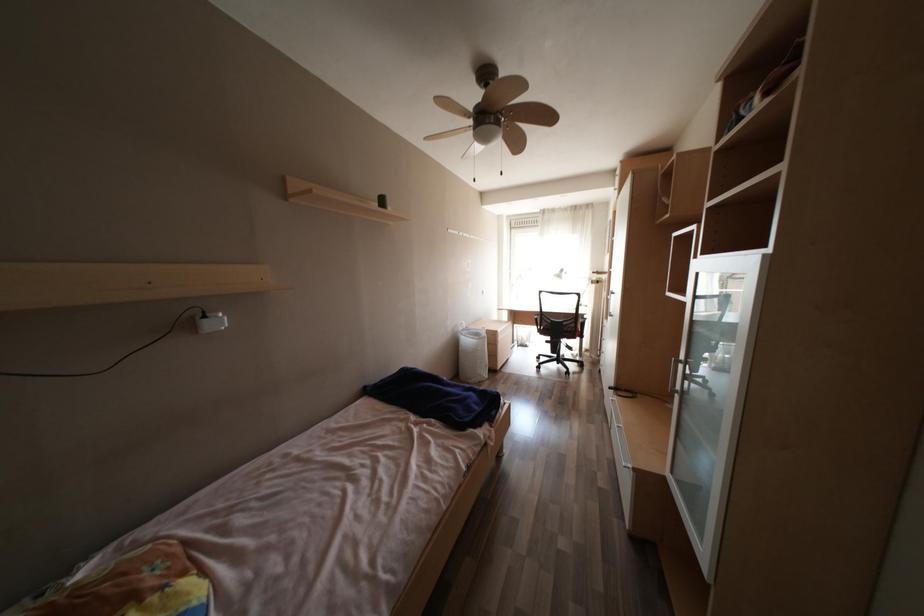
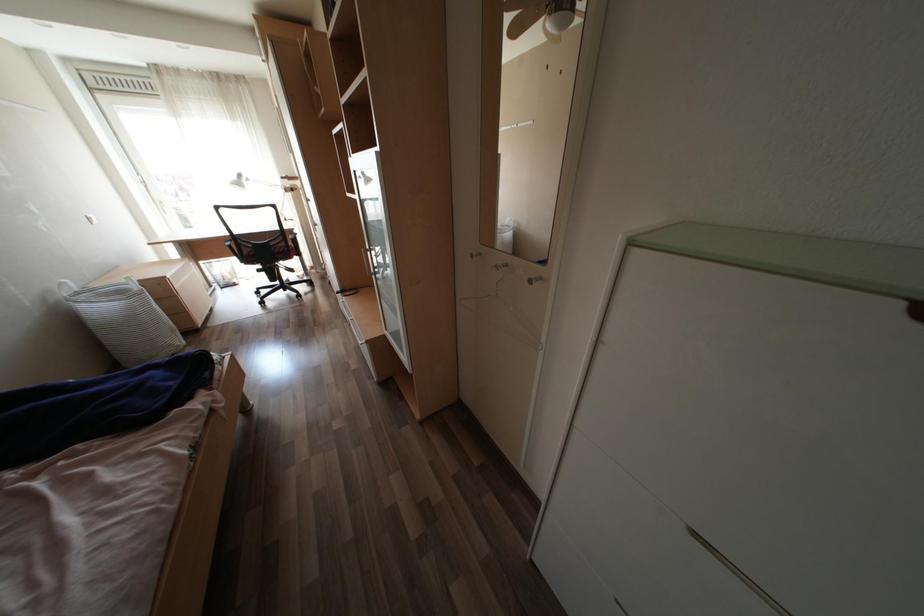
The images are taken continuously from a first-person perspective. In which direction is your viewpoint rotating?

The camera rotated toward right-down.